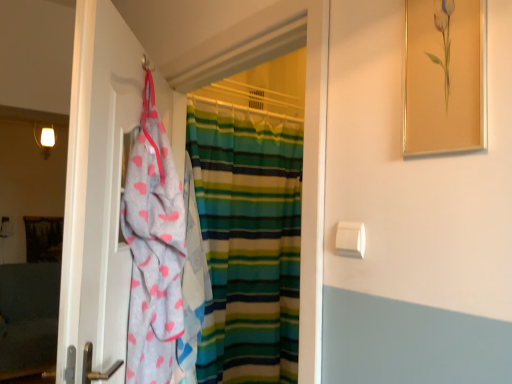
Question: Does gold-framed painting at upper right come in front of gray fabric towel at left?

Choices:
 (A) yes
 (B) no

Answer: (A)

Question: Considering the relative sizes of gold-framed painting at upper right and gray fabric towel at left in the image provided, is gold-framed painting at upper right wider than gray fabric towel at left?

Choices:
 (A) no
 (B) yes

Answer: (A)

Question: Is gold-framed painting at upper right positioned behind gray fabric towel at left?

Choices:
 (A) yes
 (B) no

Answer: (B)

Question: Does gold-framed painting at upper right have a larger size compared to gray fabric towel at left?

Choices:
 (A) yes
 (B) no

Answer: (B)

Question: Is gold-framed painting at upper right positioned with its back to gray fabric towel at left?

Choices:
 (A) yes
 (B) no

Answer: (B)

Question: From a real-world perspective, relative to striped fabric curtain at center, is gold-framed painting at upper right vertically above or below?

Choices:
 (A) below
 (B) above

Answer: (B)

Question: In the image, is gold-framed painting at upper right on the left side or the right side of striped fabric curtain at center?

Choices:
 (A) right
 (B) left

Answer: (A)

Question: Is gold-framed painting at upper right in front of or behind striped fabric curtain at center in the image?

Choices:
 (A) behind
 (B) front

Answer: (B)

Question: In terms of size, does gold-framed painting at upper right appear bigger or smaller than striped fabric curtain at center?

Choices:
 (A) small
 (B) big

Answer: (A)

Question: Is gray fabric towel at left taller or shorter than striped fabric curtain at center?

Choices:
 (A) tall
 (B) short

Answer: (B)

Question: Considering their positions, is gray fabric towel at left located in front of or behind striped fabric curtain at center?

Choices:
 (A) front
 (B) behind

Answer: (A)

Question: From the image's perspective, is gray fabric towel at left positioned above or below striped fabric curtain at center?

Choices:
 (A) below
 (B) above

Answer: (A)

Question: Is gray fabric towel at left spatially inside striped fabric curtain at center, or outside of it?

Choices:
 (A) outside
 (B) inside

Answer: (A)

Question: Is striped fabric curtain at center wider or thinner than gray fabric towel at left?

Choices:
 (A) thin
 (B) wide

Answer: (A)

Question: From the image's perspective, is striped fabric curtain at center located above or below gray fabric towel at left?

Choices:
 (A) below
 (B) above

Answer: (B)